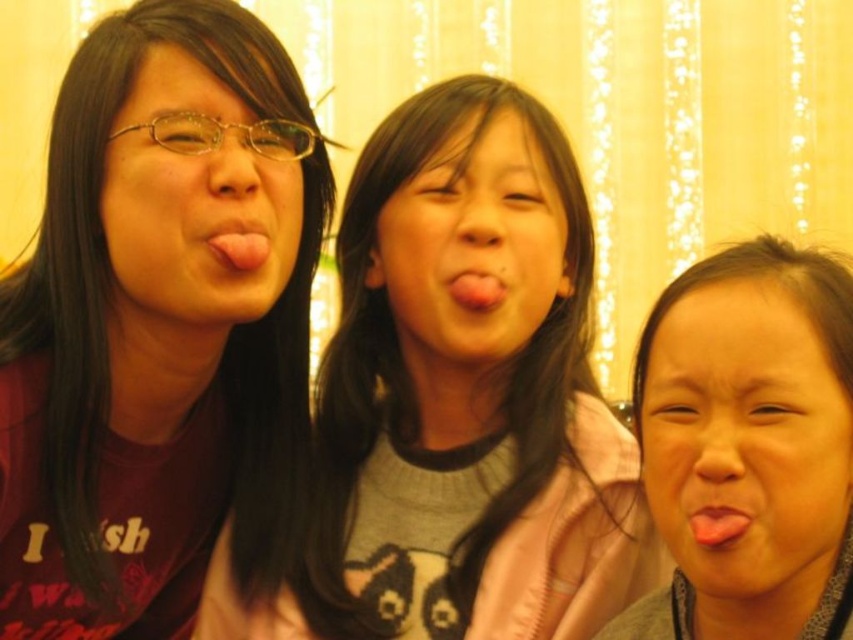
Question: Does pink glossy tongue at center appear under pink glossy tongue at lower right?

Choices:
 (A) no
 (B) yes

Answer: (A)

Question: Which is nearer to the matte gray face at center?

Choices:
 (A) pink matte tongue at center
 (B) matte black face at left
 (C) smooth skin face at center

Answer: (C)

Question: Observing the image, what is the correct spatial positioning of matte black face at left in reference to smooth skin face at center?

Choices:
 (A) right
 (B) left

Answer: (B)

Question: Can you confirm if matte gray face at center is smaller than pink matte tongue at center?

Choices:
 (A) yes
 (B) no

Answer: (B)

Question: Which object is farther from the camera taking this photo?

Choices:
 (A) matte gray face at center
 (B) matte purple shirt at left
 (C) gray sweater at center
 (D) smooth skin face at center

Answer: (D)

Question: Which point appears farthest from the camera in this image?

Choices:
 (A) (473, 304)
 (B) (555, 262)
 (C) (103, 378)
 (D) (767, 301)

Answer: (B)